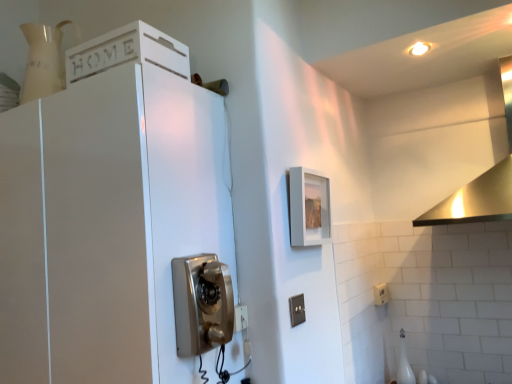
Question: Which direction should I rotate to look at black plastic switch at lower center, the second electric outlet viewed from the right?

Choices:
 (A) right
 (B) left

Answer: (A)

Question: Is the depth of white plastic electric outlet at lower right, which appears as the 1th electric outlet when viewed from the back, less than that of stainless steel vent at upper right?

Choices:
 (A) yes
 (B) no

Answer: (B)

Question: Considering the relative sizes of white plastic electric outlet at lower right, which appears as the 1th electric outlet when viewed from the back, and stainless steel vent at upper right in the image provided, is white plastic electric outlet at lower right, which appears as the 1th electric outlet when viewed from the back, taller than stainless steel vent at upper right?

Choices:
 (A) no
 (B) yes

Answer: (A)

Question: Is white plastic electric outlet at lower right, the 1th electric outlet from the bottom, positioned behind stainless steel vent at upper right?

Choices:
 (A) yes
 (B) no

Answer: (A)

Question: Would you say white plastic electric outlet at lower right, acting as the second electric outlet starting from the top, contains stainless steel vent at upper right?

Choices:
 (A) no
 (B) yes

Answer: (A)

Question: From the image's perspective, is white plastic electric outlet at lower right, which is the first electric outlet in right-to-left order, on top of stainless steel vent at upper right?

Choices:
 (A) yes
 (B) no

Answer: (B)

Question: Is white plastic electric outlet at lower right, acting as the second electric outlet starting from the top, looking in the opposite direction of stainless steel vent at upper right?

Choices:
 (A) no
 (B) yes

Answer: (A)

Question: Is white painted wood cabinet at upper left, positioned as the first cabinetry in top-to-bottom order, completely or partially inside white glossy cabinet at upper left, the 1th cabinetry from the bottom?

Choices:
 (A) yes
 (B) no

Answer: (B)

Question: Is white glossy cabinet at upper left, the 1th cabinetry from the bottom, shorter than white painted wood cabinet at upper left, which ranks as the 2th cabinetry in bottom-to-top order?

Choices:
 (A) yes
 (B) no

Answer: (B)

Question: Is white glossy cabinet at upper left, the 1th cabinetry from the bottom, oriented away from white painted wood cabinet at upper left, positioned as the first cabinetry in top-to-bottom order?

Choices:
 (A) no
 (B) yes

Answer: (A)

Question: Can you confirm if white glossy cabinet at upper left, the 1th cabinetry from the bottom, is bigger than white painted wood cabinet at upper left, which ranks as the 2th cabinetry in bottom-to-top order?

Choices:
 (A) yes
 (B) no

Answer: (A)

Question: Is white glossy cabinet at upper left, the 1th cabinetry from the bottom, beside white painted wood cabinet at upper left, which ranks as the 2th cabinetry in bottom-to-top order?

Choices:
 (A) no
 (B) yes

Answer: (A)

Question: Can you confirm if white glossy cabinet at upper left, the 1th cabinetry from the bottom, is positioned to the right of white painted wood cabinet at upper left, which ranks as the 2th cabinetry in bottom-to-top order?

Choices:
 (A) no
 (B) yes

Answer: (A)

Question: From the image's perspective, is black plastic switch at lower center, which is the second electric outlet from back to front, located beneath stainless steel vent at upper right?

Choices:
 (A) yes
 (B) no

Answer: (A)